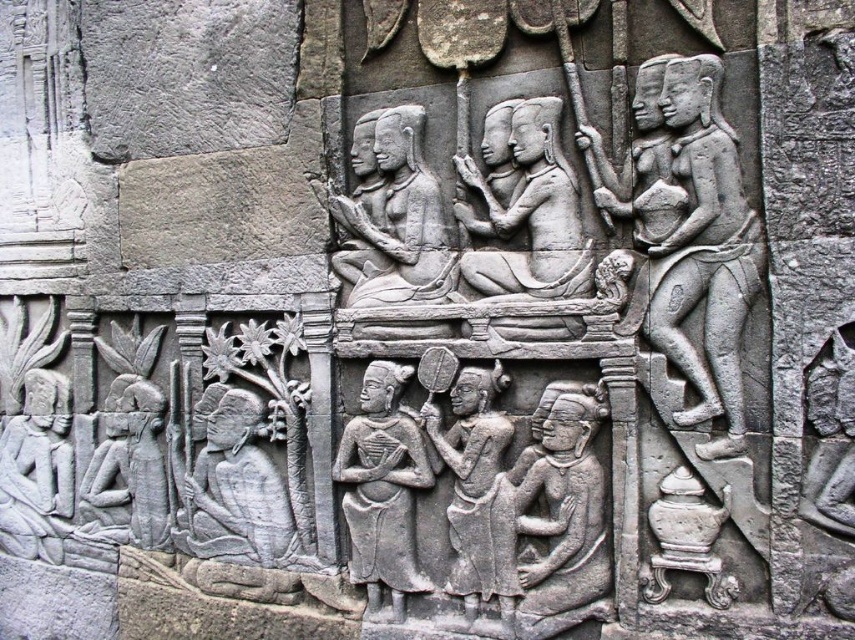
Question: Is gray stone figure at center positioned before gray stone figure at lower left?

Choices:
 (A) yes
 (B) no

Answer: (A)

Question: Which of the following is the farthest from the observer?

Choices:
 (A) (51, 541)
 (B) (376, 486)

Answer: (A)

Question: In this image, where is gray stone figures at center located relative to gray stone figure at center?

Choices:
 (A) left
 (B) right

Answer: (B)

Question: Based on their relative distances, which object is farther from the gray stone figure at lower center?

Choices:
 (A) gray stone figure at right
 (B) gray stone carving of figures at center

Answer: (B)

Question: Which of the following is the closest to the observer?

Choices:
 (A) gray stone figure at lower left
 (B) gray stone figures at center

Answer: (B)

Question: Does gray stone figure at lower center appear on the left side of gray stone carving of figures at center?

Choices:
 (A) yes
 (B) no

Answer: (B)